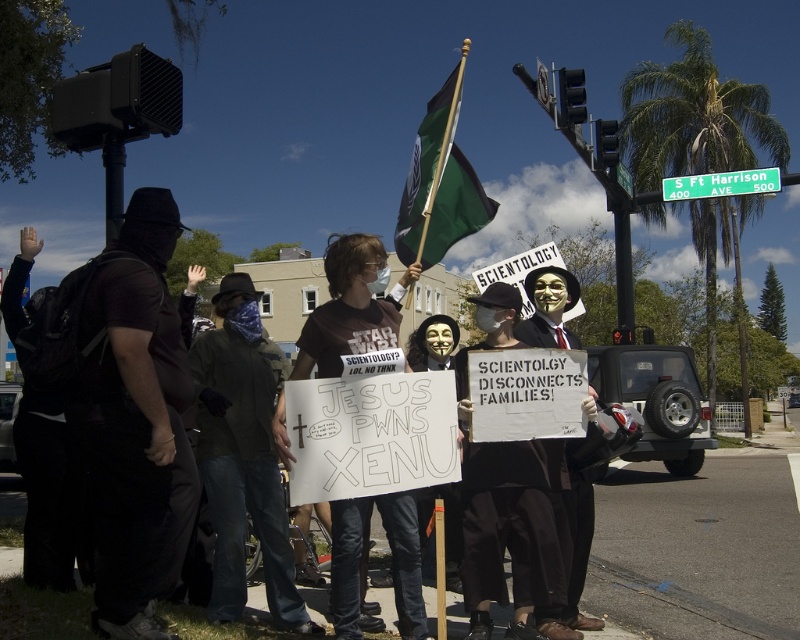
Question: Which point appears farthest from the camera in this image?

Choices:
 (A) pos(414,211)
 (B) pos(752,188)
 (C) pos(536,307)
 (D) pos(156,268)

Answer: (B)

Question: Does matte black suit at center have a greater width compared to green plastic street sign at upper center?

Choices:
 (A) no
 (B) yes

Answer: (A)

Question: Among these objects, which one is nearest to the camera?

Choices:
 (A) green plastic street sign at upper center
 (B) green fabric flag at center
 (C) black matte clothing at left
 (D) matte black suit at center

Answer: (C)

Question: Which of the following is the farthest from the observer?

Choices:
 (A) green fabric flag at center
 (B) black matte clothing at left

Answer: (A)

Question: Considering the relative positions of black matte clothing at left and green plastic street sign at upper center in the image provided, where is black matte clothing at left located with respect to green plastic street sign at upper center?

Choices:
 (A) left
 (B) right

Answer: (A)

Question: Is black matte clothing at left positioned before green plastic street sign at upper center?

Choices:
 (A) no
 (B) yes

Answer: (B)